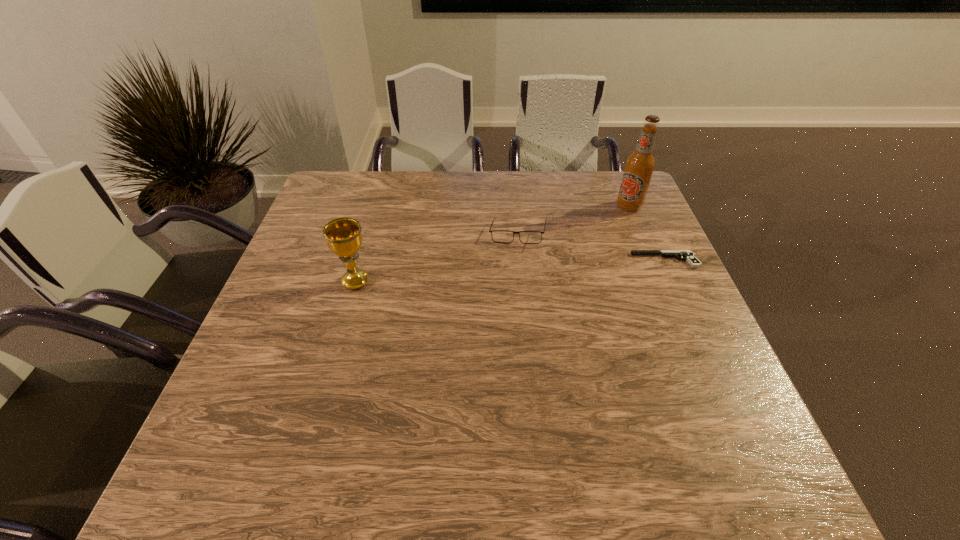
You are a GUI agent. You are given a task and a screenshot of the screen. Output one action in this format:
    pyautogui.click(x=<x>, y=<y>)
    Task: Click on the chalice
    
    Given the screenshot: What is the action you would take?
    pyautogui.click(x=343, y=236)

Locate an element on the screen. the nearest object is located at coordinates 343,236.

The image size is (960, 540). In order to click on pistol in this screenshot , I will do `click(688, 255)`.

Where is `the third farthest object`? The image size is (960, 540). the third farthest object is located at coordinates 688,255.

In order to click on the third object from right to left in this screenshot , I will do `click(499, 236)`.

Locate an element on the screen. the third tallest object is located at coordinates (499, 236).

This screenshot has width=960, height=540. In order to click on beer bottle in this screenshot , I will do `click(639, 166)`.

Identify the location of the tallest object. (639, 166).

I want to click on free space located 0.160m on the right of the second tallest object, so click(437, 282).

Where is `vacant space located on the front-facing side of the shortest object`? This screenshot has width=960, height=540. vacant space located on the front-facing side of the shortest object is located at coordinates (492, 260).